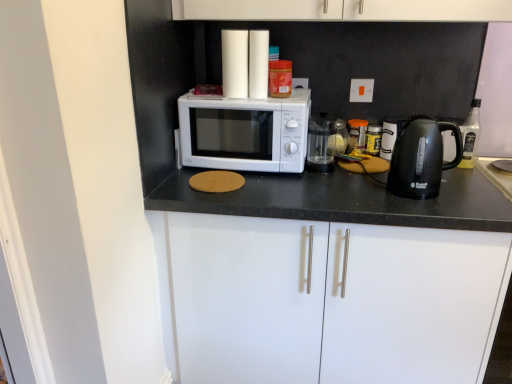
Identify the location of vacant area situated to the left side of black plastic kettle at right. The width and height of the screenshot is (512, 384). (364, 190).